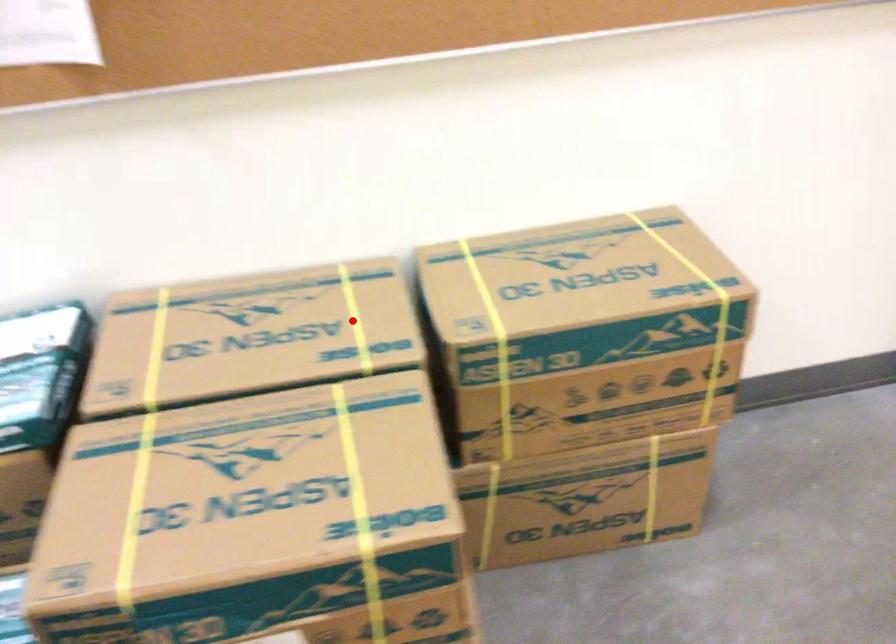
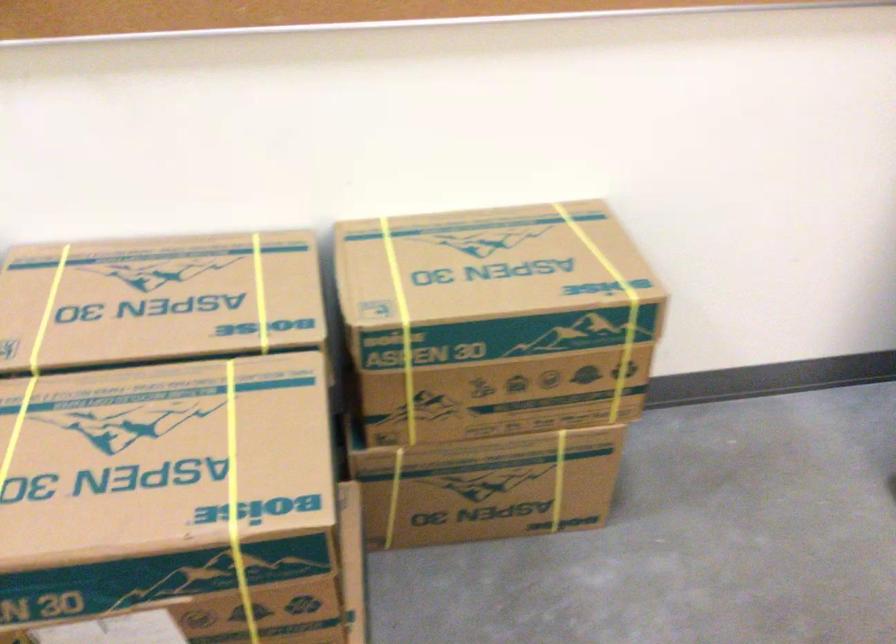
The point at the highlighted location is marked in the first image. Where is the corresponding point in the second image?

(260, 292)